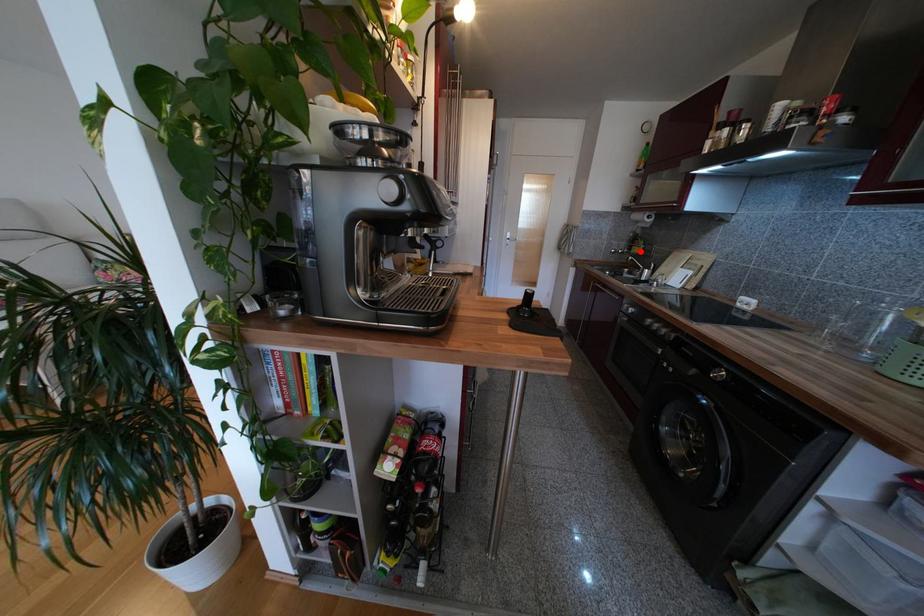
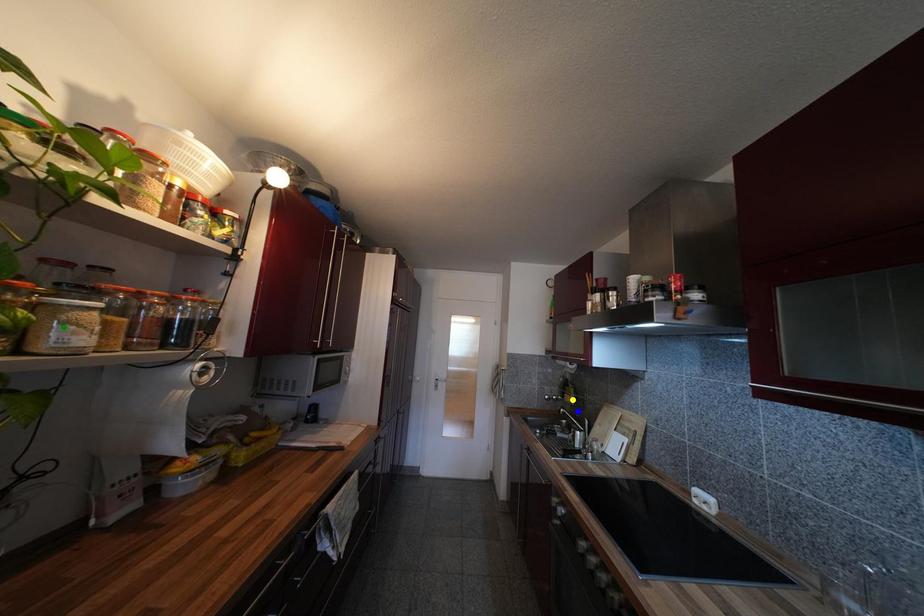
Question: I am providing you with two images of the same scene from different viewpoints. A red point is marked on the first image. You are given multiple points on the second image. Can you choose the point in image 2 that corresponds to the point in image 1?

Choices:
 (A) green point
 (B) yellow point
 (C) blue point

Answer: (B)